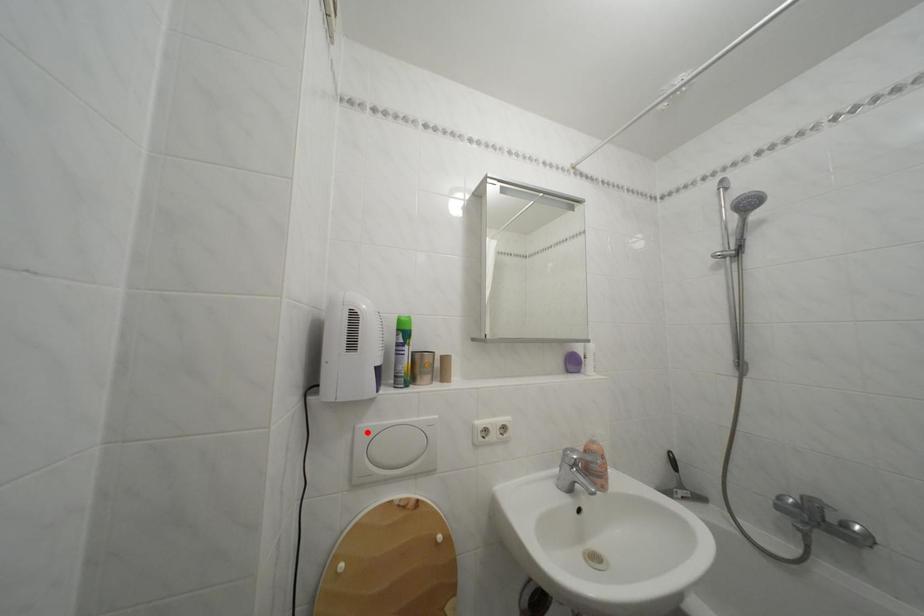
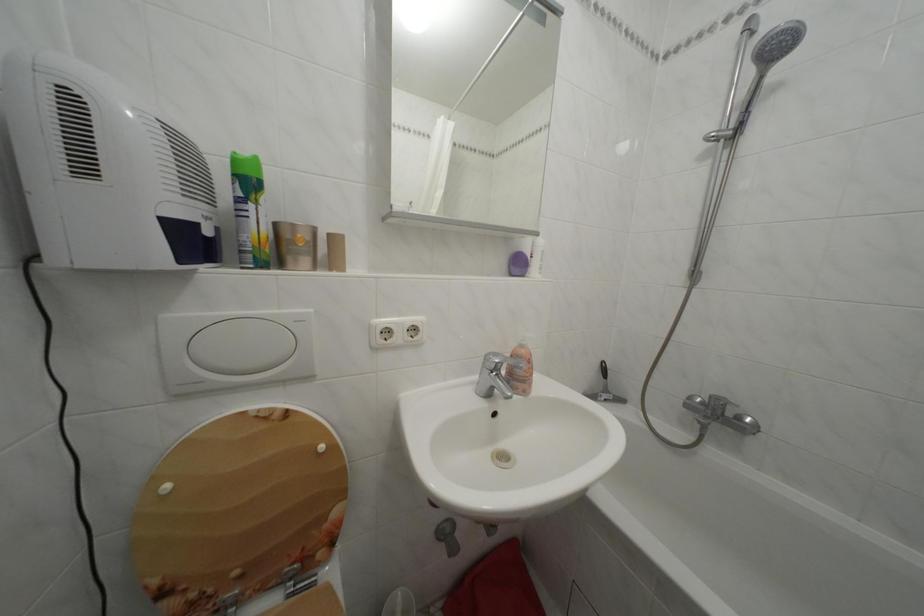
Find the pixel in the second image that matches the highlighted location in the first image.

(174, 323)